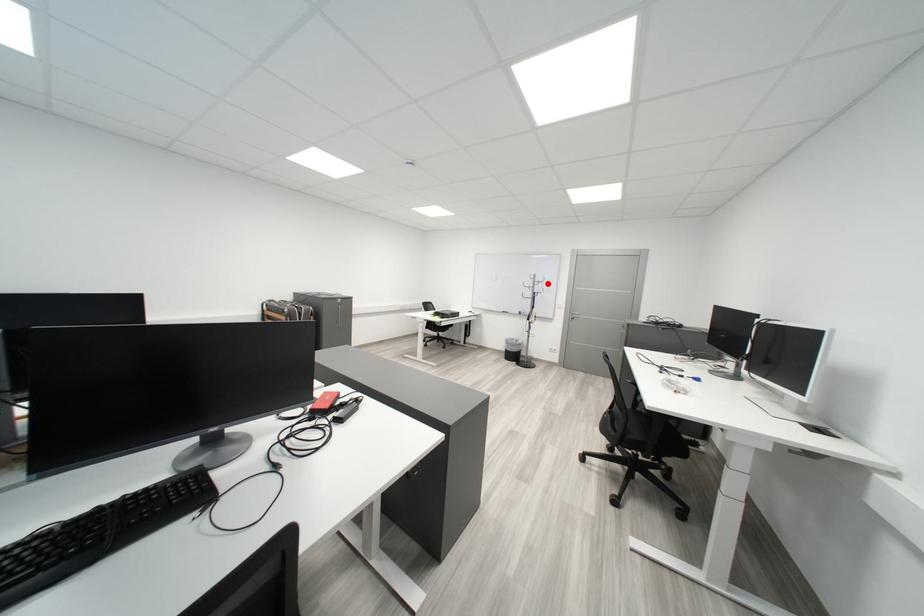
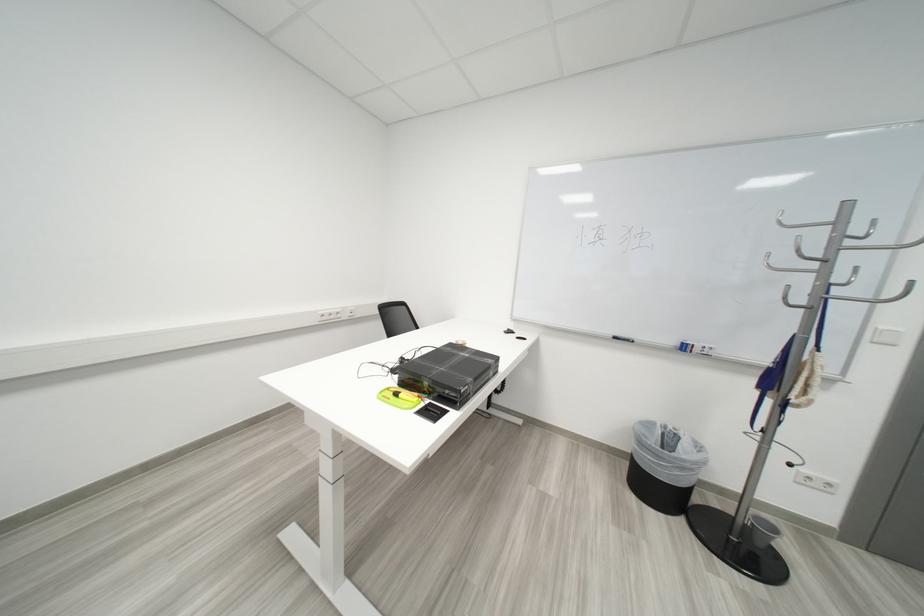
Question: A red point is marked in image1. In image2, is the corresponding 3D point closer to the camera or farther? Reply with the corresponding letter.

Choices:
 (A) The corresponding 3D point is closer.
 (B) The corresponding 3D point is farther.

Answer: (B)